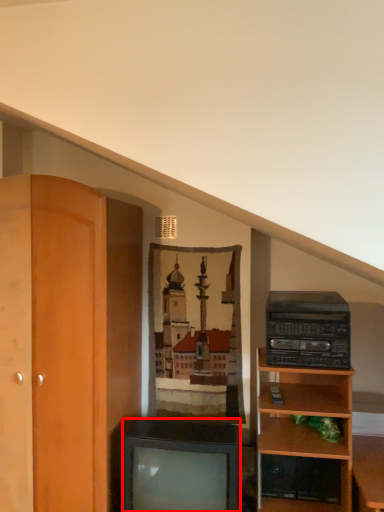
Question: Where is television (annotated by the red box) located in relation to stereo in the image?

Choices:
 (A) right
 (B) left

Answer: (B)